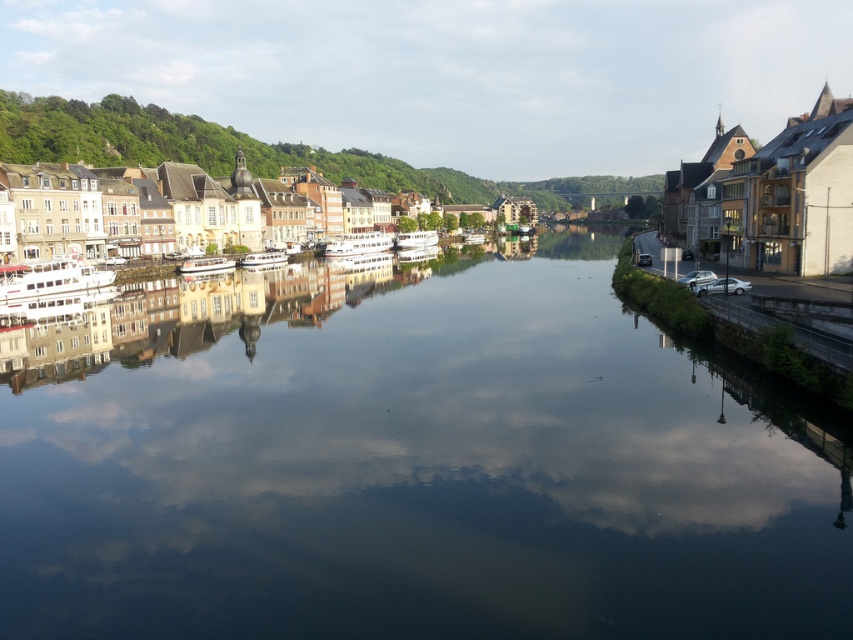
Question: Does smooth reflective water at center appear under green leafy hillside at upper left?

Choices:
 (A) no
 (B) yes

Answer: (B)

Question: Can you confirm if smooth reflective water at center is positioned to the left of green leafy hillside at upper left?

Choices:
 (A) yes
 (B) no

Answer: (B)

Question: Which point appears closest to the camera in this image?

Choices:
 (A) (80, 115)
 (B) (808, 449)
 (C) (170, 186)

Answer: (B)

Question: Which is farther from the matte yellow building at left?

Choices:
 (A) green leafy hillside at upper left
 (B) smooth reflective water at center

Answer: (A)

Question: Is smooth reflective water at center to the right of matte yellow building at left from the viewer's perspective?

Choices:
 (A) yes
 (B) no

Answer: (A)

Question: Which point is farther to the camera?

Choices:
 (A) (155, 406)
 (B) (265, 144)

Answer: (B)